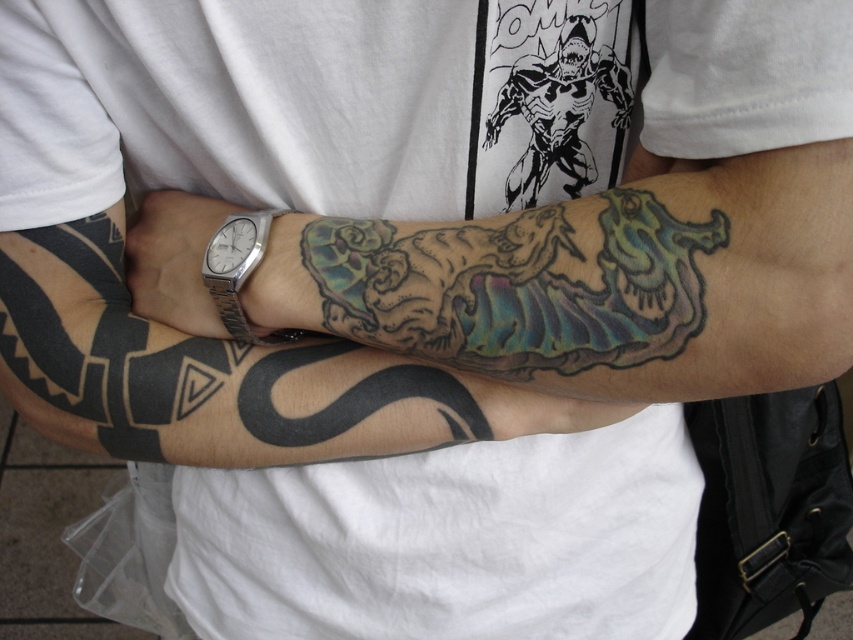
Who is shorter, silver metallic watch at left or silver metallic watch at center?

Standing shorter between the two is silver metallic watch at center.

Is silver metallic watch at left bigger than silver metallic watch at center?

Yes, silver metallic watch at left is bigger than silver metallic watch at center.

Is point (171, 320) behind point (225, 250)?

That is True.

The width and height of the screenshot is (853, 640). I want to click on silver metallic watch at left, so click(x=196, y=264).

Who is positioned more to the right, multicolored ink dragon at center or silver metallic watch at left?

Positioned to the right is multicolored ink dragon at center.

Is multicolored ink dragon at center to the right of silver metallic watch at left from the viewer's perspective?

Correct, you'll find multicolored ink dragon at center to the right of silver metallic watch at left.

Who is more distant from viewer, (637, 344) or (132, 262)?

The point (132, 262) is behind.

This screenshot has width=853, height=640. Find the location of `multicolored ink dragon at center`. multicolored ink dragon at center is located at coordinates (520, 284).

Measure the distance between multicolored ink dragon at center and silver metallic watch at center.

A distance of 12.64 centimeters exists between multicolored ink dragon at center and silver metallic watch at center.

Does multicolored ink dragon at center come behind silver metallic watch at center?

No, it is not.

The image size is (853, 640). Describe the element at coordinates (520, 284) in the screenshot. I see `multicolored ink dragon at center` at that location.

Find the location of `multicolored ink dragon at center`. multicolored ink dragon at center is located at coordinates (520, 284).